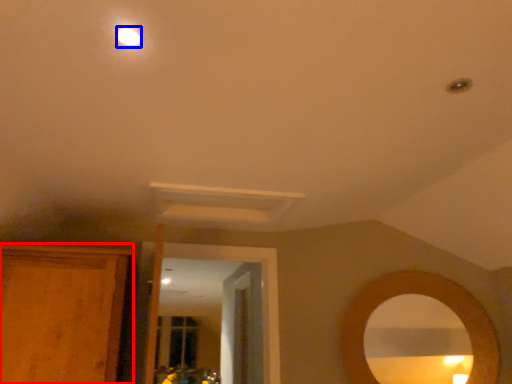
Question: Which object appears closest to the camera in this image, cabinetry (highlighted by a red box) or lighting (highlighted by a blue box)?

Choices:
 (A) cabinetry
 (B) lighting

Answer: (B)